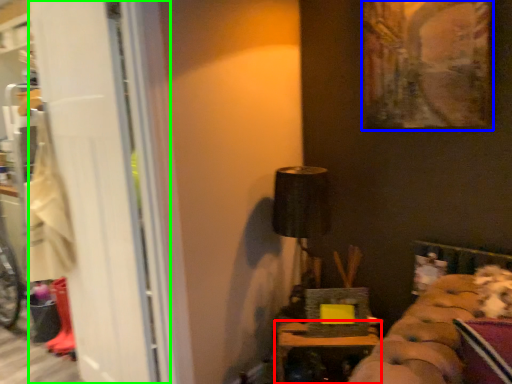
Question: Which object is the closest to the furniture (highlighted by a red box)? Choose among these: picture frame (highlighted by a blue box) or screen door (highlighted by a green box).

Choices:
 (A) picture frame
 (B) screen door

Answer: (B)